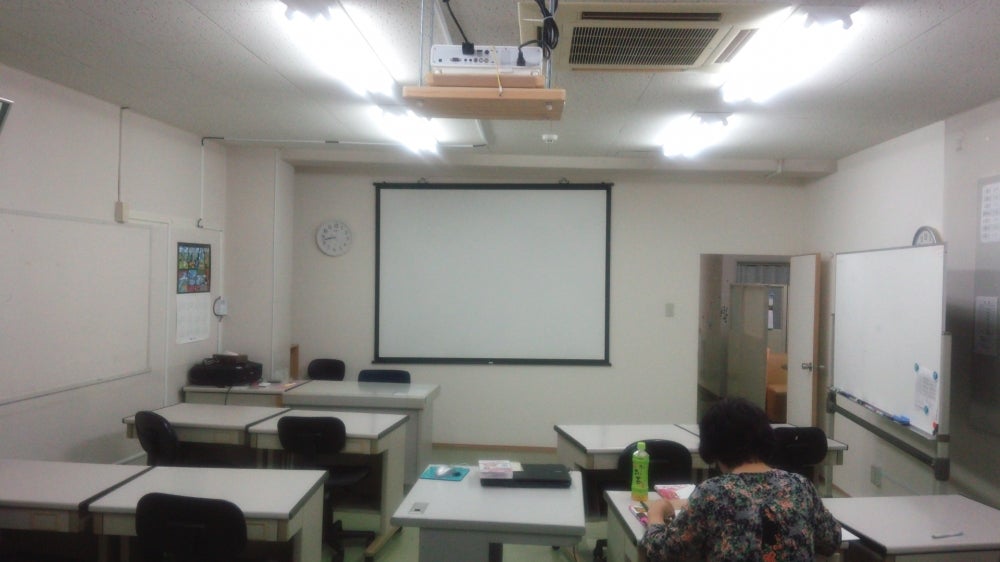
You are a GUI agent. You are given a task and a screenshot of the screen. Output one action in this format:
    pyautogui.click(x=<x>, y=<y>)
    Task: Click on the chair
    The image size is (1000, 562).
    Given the screenshot: What is the action you would take?
    pyautogui.click(x=195, y=532), pyautogui.click(x=150, y=434), pyautogui.click(x=318, y=443), pyautogui.click(x=326, y=373), pyautogui.click(x=667, y=457)